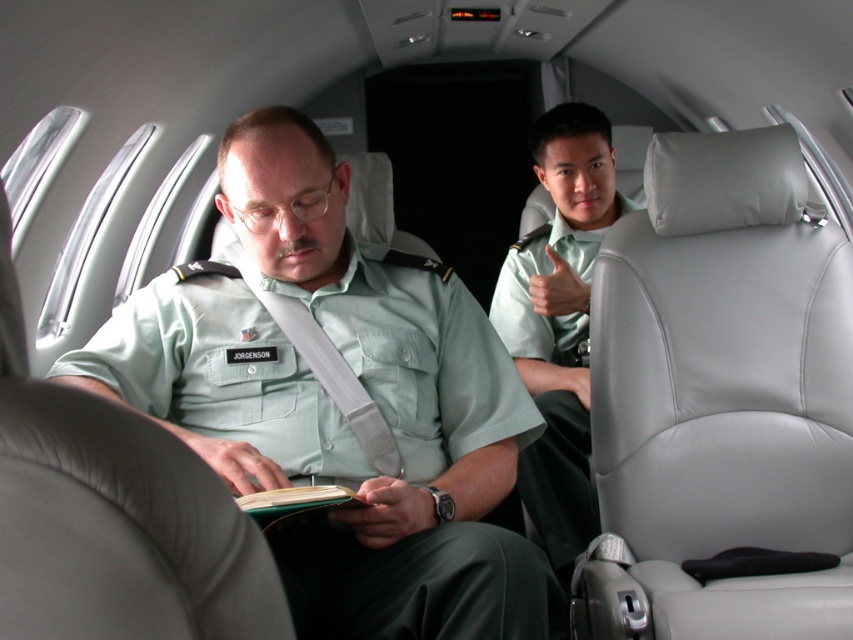
How far apart are green uniform at center and light green fabric shirt at center?

The distance of green uniform at center from light green fabric shirt at center is 1.09 meters.

Is green uniform at center to the left of light green fabric shirt at center from the viewer's perspective?

Indeed, green uniform at center is positioned on the left side of light green fabric shirt at center.

Is point (397, 476) closer to viewer compared to point (584, 416)?

Yes, it is in front of point (584, 416).

Locate an element on the screen. This screenshot has width=853, height=640. green uniform at center is located at coordinates (339, 403).

Between point (381, 552) and point (334, 502), which one is positioned in front?

Point (334, 502) is in front.

Is point (422, 275) less distant than point (305, 508)?

No.

In order to click on green uniform at center in this screenshot , I will do `click(339, 403)`.

Does light green fabric shirt at center appear over green matte book at center?

Yes.

Can you confirm if light green fabric shirt at center is positioned to the right of green matte book at center?

Yes, light green fabric shirt at center is to the right of green matte book at center.

Is point (537, 528) less distant than point (297, 515)?

No, (537, 528) is behind (297, 515).

I want to click on light green fabric shirt at center, so click(560, 476).